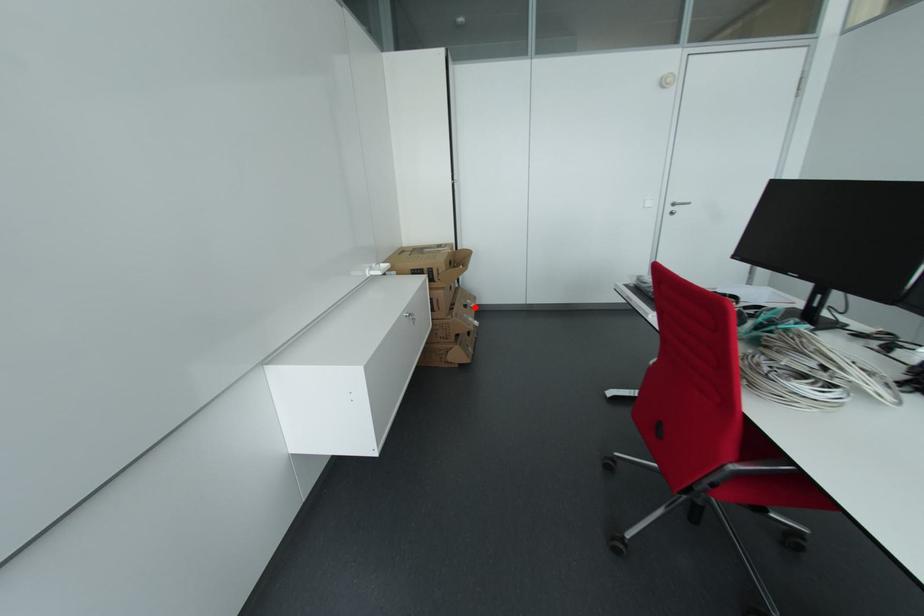
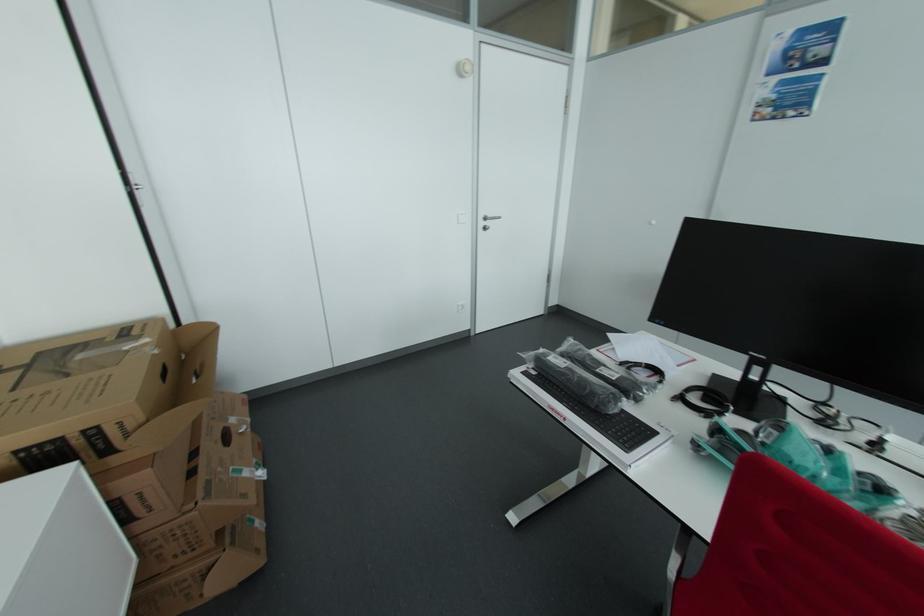
Question: I am providing you with two images of the same scene from different viewpoints. Given a red point in image1, look at the same physical point in image2. Is it:

Choices:
 (A) Closer to the viewpoint
 (B) Farther from the viewpoint

Answer: (A)